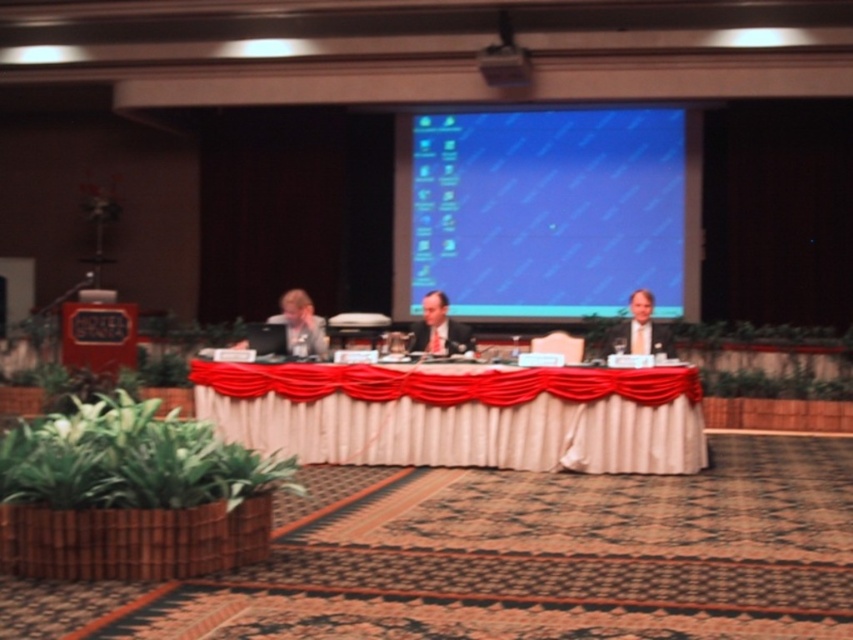
Consider the image. Between white satin table at center and light brown hair at center, which one appears on the left side from the viewer's perspective?

white satin table at center is more to the left.

Can you confirm if white satin table at center is positioned below light brown hair at center?

Indeed, white satin table at center is positioned under light brown hair at center.

Where is `white satin table at center`? This screenshot has height=640, width=853. white satin table at center is located at coordinates (460, 416).

Identify the location of white satin table at center. This screenshot has width=853, height=640. (460, 416).

Is point (651, 385) positioned in front of point (439, 316)?

That is True.

Is white satin table at center in front of smooth gray suit at center?

Yes.

Where is `white satin table at center`? white satin table at center is located at coordinates (460, 416).

Locate an element on the screen. white satin table at center is located at coordinates (460, 416).

Does point (422, 324) lie in front of point (647, 352)?

No, (422, 324) is further to viewer.

The image size is (853, 640). Describe the element at coordinates (439, 330) in the screenshot. I see `smooth gray suit at center` at that location.

Between point (431, 316) and point (666, 332), which one is positioned in front?

Point (666, 332)

At what (x,y) coordinates should I click in order to perform the action: click on smooth gray suit at center. Please return your answer as a coordinate pair (x, y). Looking at the image, I should click on (439, 330).